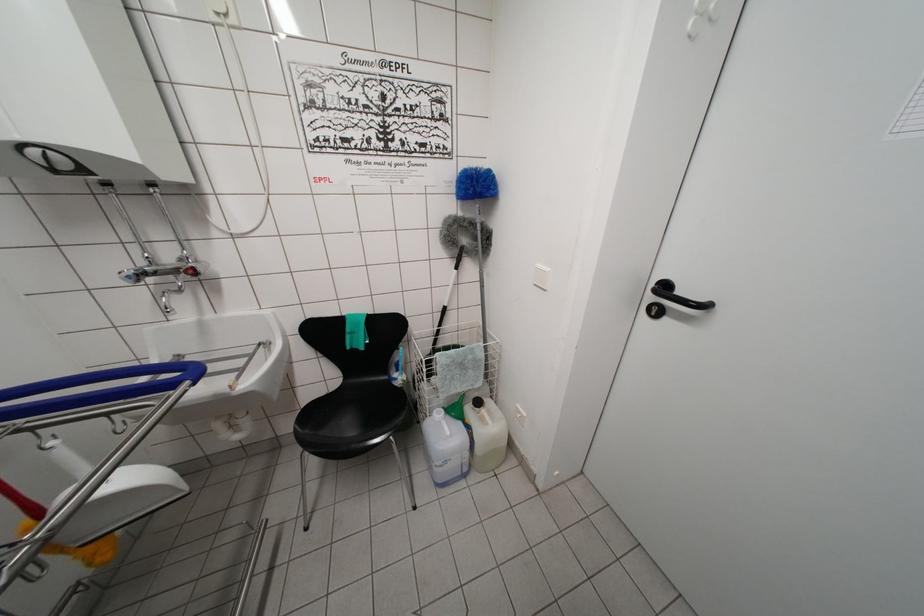
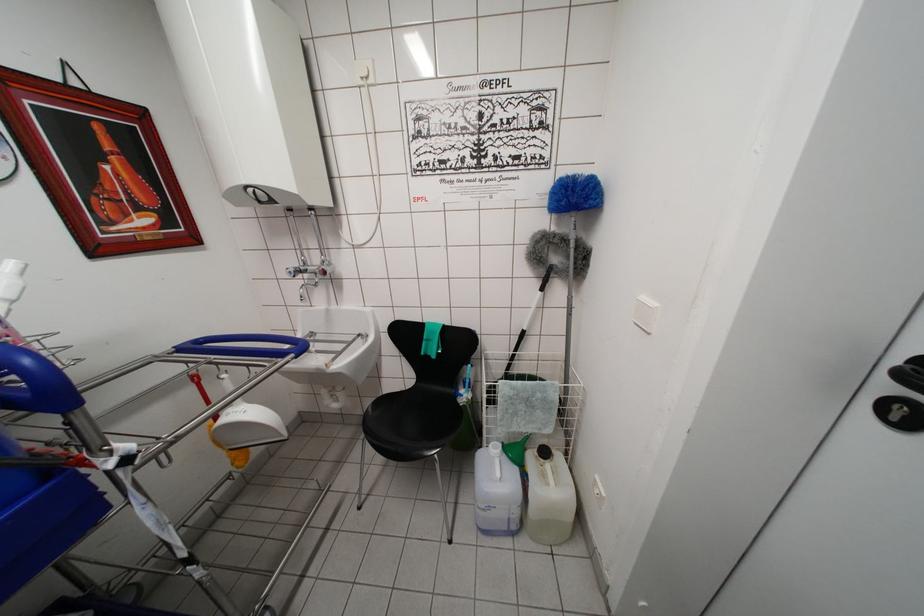
The point at (657, 318) is marked in the first image. Where is the corresponding point in the second image?

(897, 423)